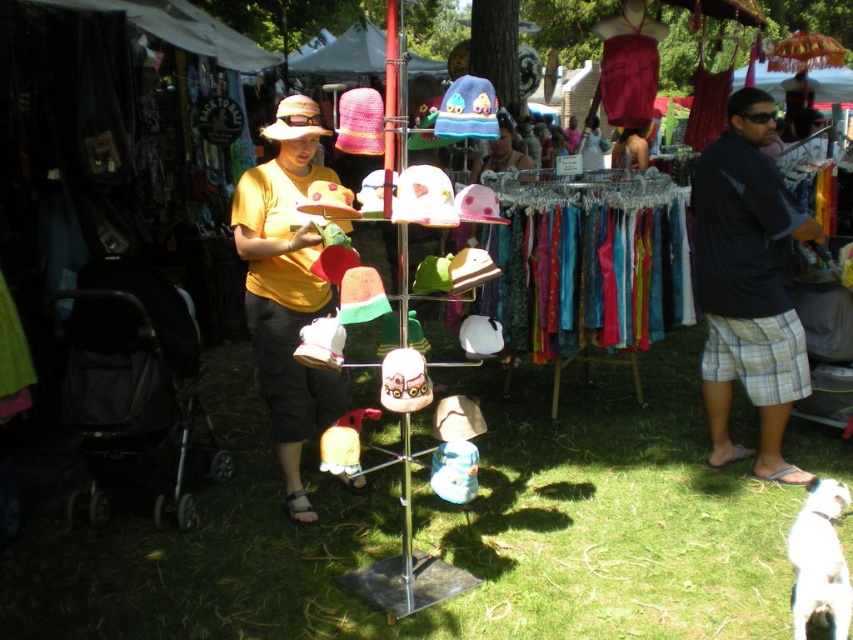
Does yellow matte shirt at center have a lesser height compared to matte pink hat at center?

Incorrect, yellow matte shirt at center's height does not fall short of matte pink hat at center's.

Which is behind, point (294, 481) or point (498, 148)?

The point (498, 148) is more distant.

Find the location of `yellow matte shirt at center`. yellow matte shirt at center is located at coordinates (286, 289).

Find the location of a particular element. yellow matte shirt at center is located at coordinates (286, 289).

Measure the distance between white fur dog at lower right and matte pink hat at center.

white fur dog at lower right and matte pink hat at center are 3.47 meters apart.

You are a GUI agent. You are given a task and a screenshot of the screen. Output one action in this format:
    pyautogui.click(x=<x>, y=<y>)
    Task: Click on the white fur dog at lower right
    This screenshot has width=853, height=640.
    Given the screenshot: What is the action you would take?
    pyautogui.click(x=819, y=561)

Does dark blue shirt at right appear under yellow matte shirt at center?

Actually, dark blue shirt at right is above yellow matte shirt at center.

Does dark blue shirt at right appear on the right side of yellow matte shirt at center?

Correct, you'll find dark blue shirt at right to the right of yellow matte shirt at center.

Is point (711, 276) positioned after point (294, 440)?

That is True.

The height and width of the screenshot is (640, 853). I want to click on dark blue shirt at right, so click(x=747, y=284).